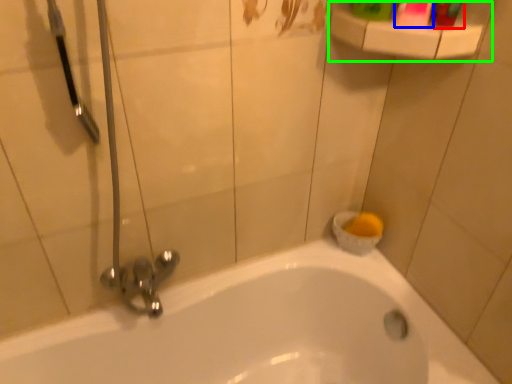
Question: Which object is the closest to the toiletry (highlighted by a red box)? Choose among these: mouthwash (highlighted by a blue box) or balustrade (highlighted by a green box).

Choices:
 (A) mouthwash
 (B) balustrade

Answer: (A)